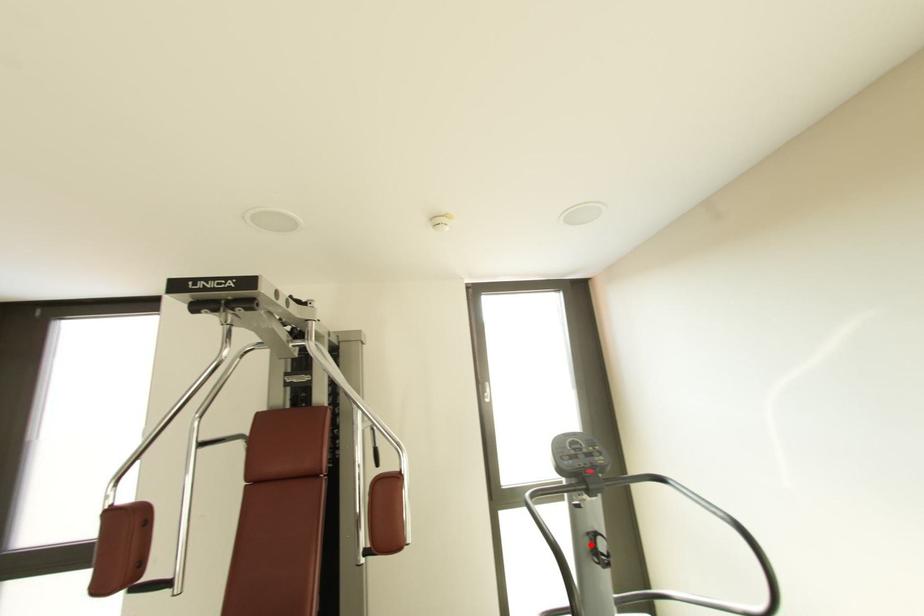
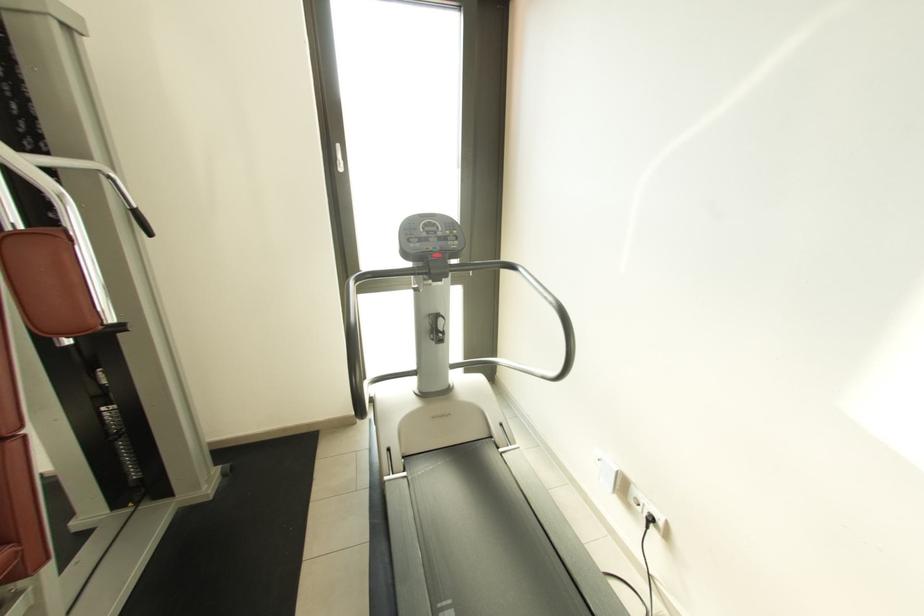
Where in the second image is the point corresponding to the highlighted location from the first image?

(432, 325)